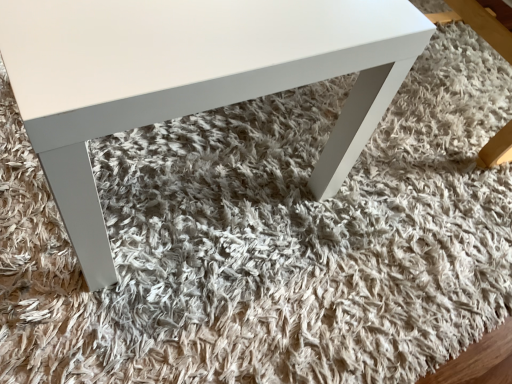
Measure the distance between point (x=322, y=153) and camera.

Point (x=322, y=153) and camera are 36.61 inches apart.

The image size is (512, 384). Find the location of `white glossy table at center`. white glossy table at center is located at coordinates (190, 79).

What is the approximate width of white glossy table at center?

white glossy table at center is 22.72 inches wide.

Image resolution: width=512 pixels, height=384 pixels. Describe the element at coordinates (190, 79) in the screenshot. I see `white glossy table at center` at that location.

Image resolution: width=512 pixels, height=384 pixels. What are the coordinates of `white glossy table at center` in the screenshot? It's located at (190, 79).